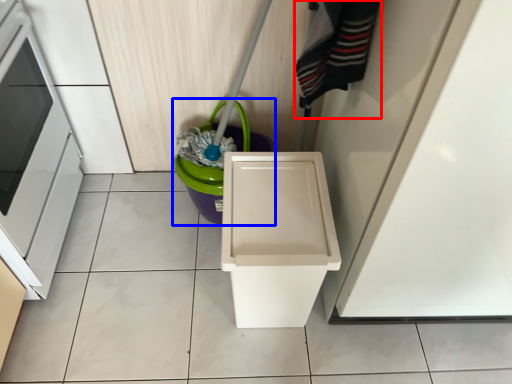
Question: Which of the following is the farthest to the observer, clothing (highlighted by a red box) or potty (highlighted by a blue box)?

Choices:
 (A) clothing
 (B) potty

Answer: (B)